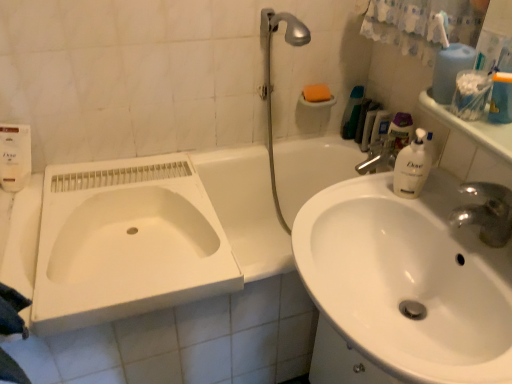
You are a GUI agent. You are given a task and a screenshot of the screen. Output one action in this format:
    pyautogui.click(x=<x>, y=<y>)
    Task: Click on the empty space that is ontop of white plastic container at upper right
    This screenshot has width=512, height=384.
    Given the screenshot: What is the action you would take?
    pyautogui.click(x=480, y=107)